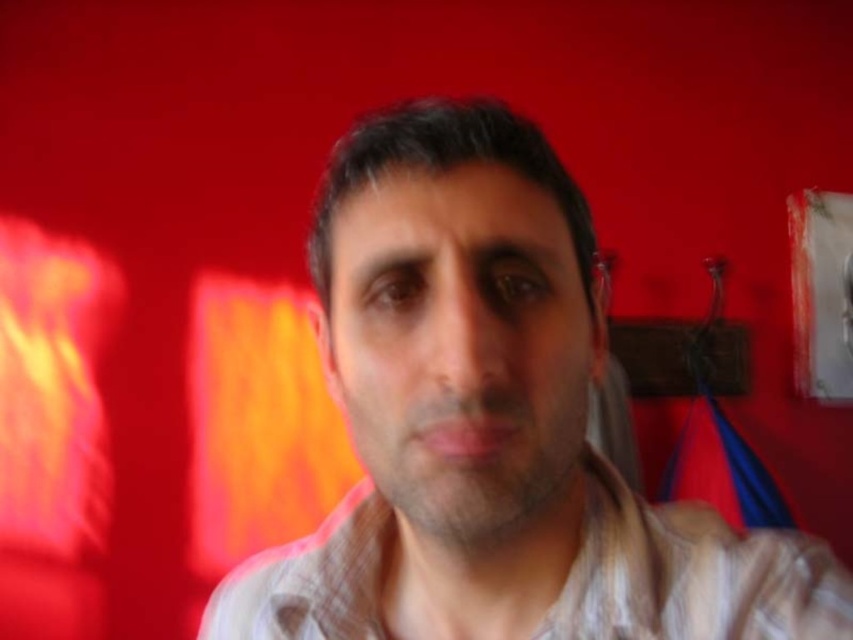
Is light beige striped shirt at center further to camera compared to brown plaid shirt at center?

No, light beige striped shirt at center is closer to the viewer.

Measure the distance from light beige striped shirt at center to brown plaid shirt at center.

A distance of 5.35 centimeters exists between light beige striped shirt at center and brown plaid shirt at center.

At what (x,y) coordinates should I click in order to perform the action: click on light beige striped shirt at center. Please return your answer as a coordinate pair (x, y). This screenshot has width=853, height=640. Looking at the image, I should click on (492, 422).